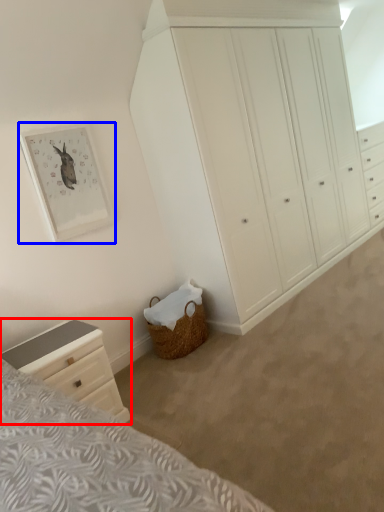
Question: Which point is closer to the camera, chest of drawers (highlighted by a red box) or picture frame (highlighted by a blue box)?

Choices:
 (A) chest of drawers
 (B) picture frame

Answer: (A)